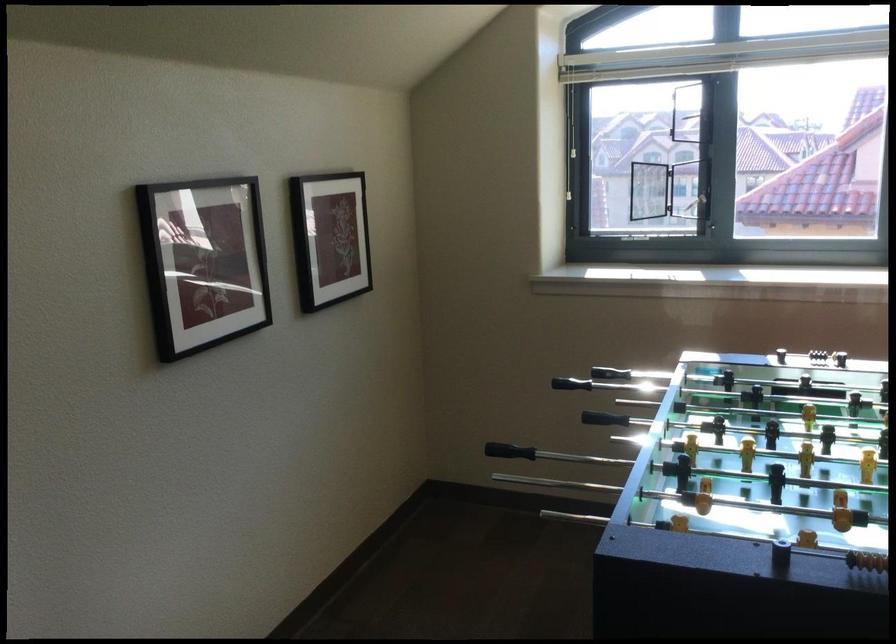
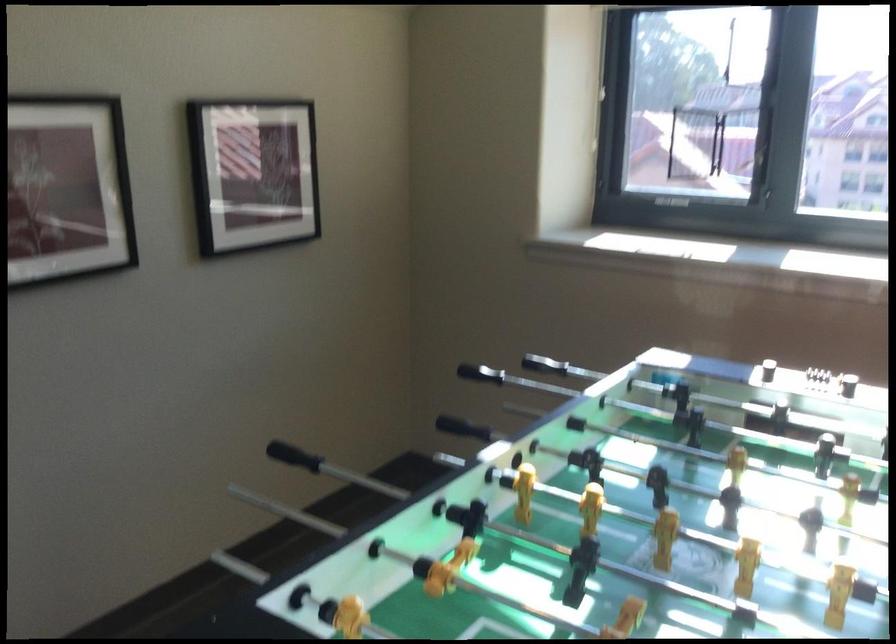
Find the pixel in the second image that matches (366,476) in the first image.

(294, 456)